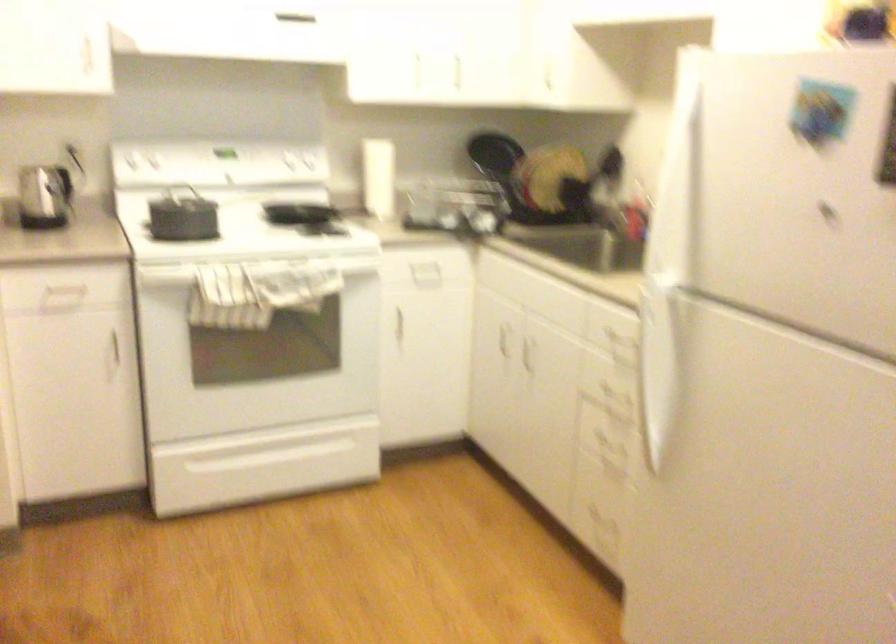
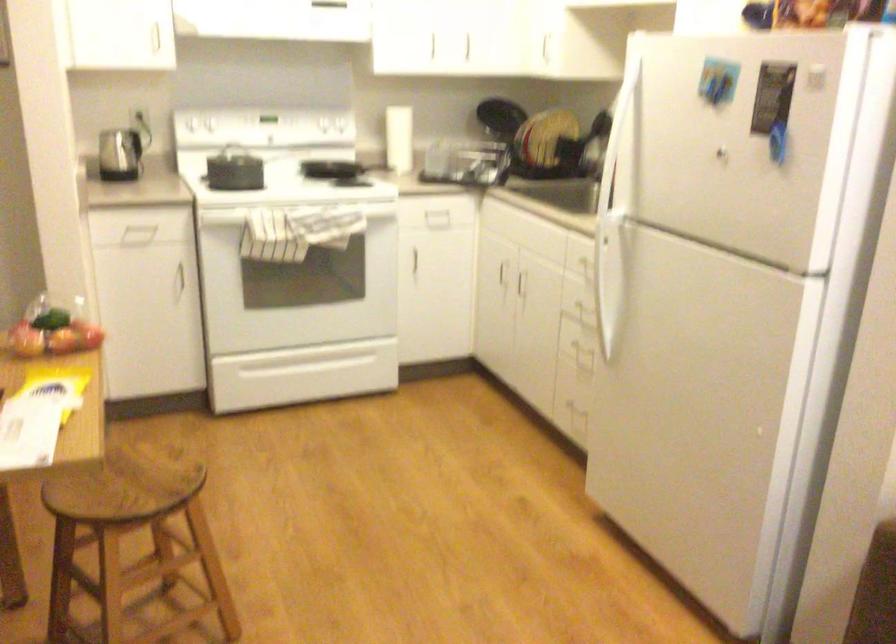
In the second image, find the point that corresponds to pixel 259 447 in the first image.

(298, 360)